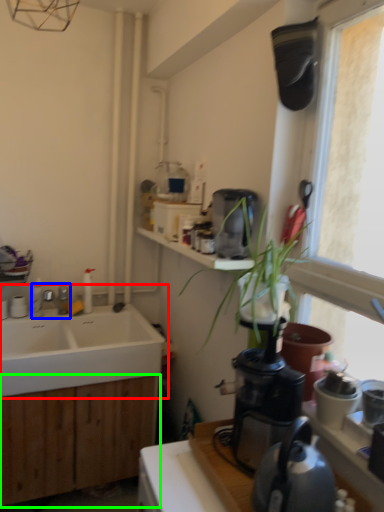
Question: Estimate the real-world distances between objects in this image. Which object is closer to sink (highlighted by a red box), tap (highlighted by a blue box) or cabinetry (highlighted by a green box)?

Choices:
 (A) tap
 (B) cabinetry

Answer: (B)